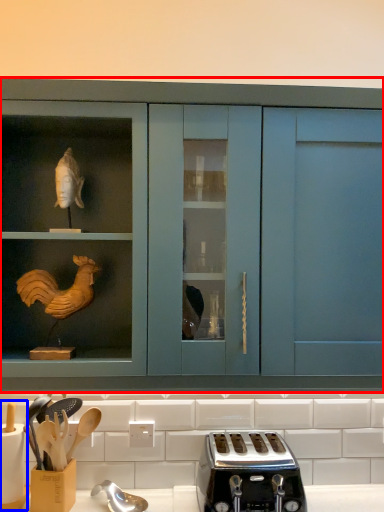
Question: Which object appears closest to the camera in this image, cabinetry (highlighted by a red box) or appliance (highlighted by a blue box)?

Choices:
 (A) cabinetry
 (B) appliance

Answer: (A)